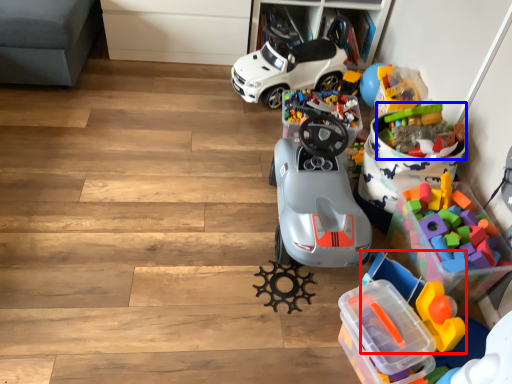
Question: Which of the following is the closest to the observer, toy (highlighted by a red box) or toy (highlighted by a blue box)?

Choices:
 (A) toy
 (B) toy

Answer: (A)